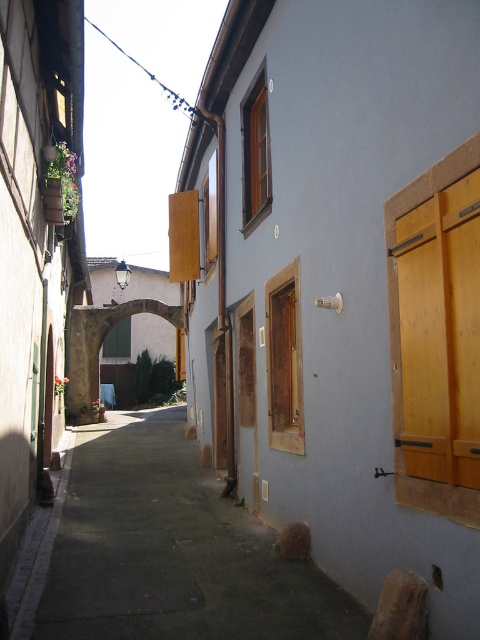
Question: Can you confirm if smooth concrete sidewalk at center is bigger than yellow wood shutters at right?

Choices:
 (A) no
 (B) yes

Answer: (B)

Question: Can you confirm if smooth concrete sidewalk at center is positioned above yellow wood shutters at right?

Choices:
 (A) no
 (B) yes

Answer: (A)

Question: Among these objects, which one is farthest from the camera?

Choices:
 (A) yellow wood shutters at right
 (B) smooth concrete sidewalk at center

Answer: (B)

Question: Which point is farther from the camera taking this photo?

Choices:
 (A) (145, 454)
 (B) (414, 236)

Answer: (A)

Question: In this image, where is smooth concrete sidewalk at center located relative to yellow wood shutters at right?

Choices:
 (A) right
 (B) left

Answer: (B)

Question: Among these points, which one is farthest from the camera?

Choices:
 (A) (437, 394)
 (B) (350, 621)

Answer: (B)